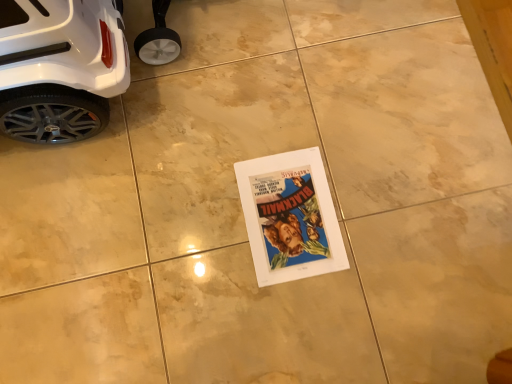
The width and height of the screenshot is (512, 384). Identify the location of vacant region in front of vibrant paper movie poster at center. (294, 322).